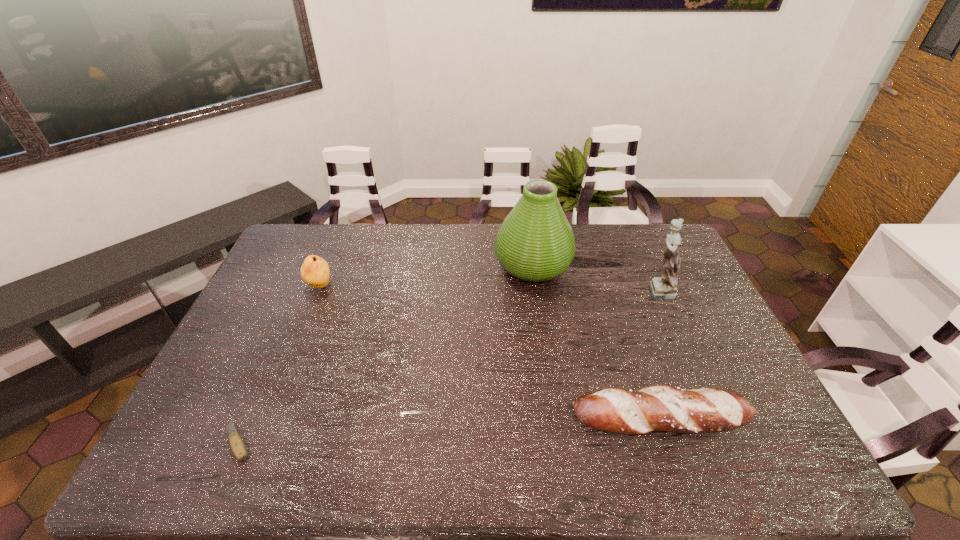
Image resolution: width=960 pixels, height=540 pixels. I want to click on free space between the figurine and the fourth tallest object, so click(659, 355).

Identify the location of free space that is in between the figurine and the pear. (489, 288).

The width and height of the screenshot is (960, 540). Find the location of `free space between the pear and the vase`. free space between the pear and the vase is located at coordinates (426, 275).

The width and height of the screenshot is (960, 540). In order to click on free spot between the vase and the pear in this screenshot , I will do `click(426, 275)`.

Find the location of a particular element. This screenshot has height=540, width=960. unoccupied position between the pear and the figurine is located at coordinates (489, 288).

Choose which object is the third nearest neighbor to the shortest object. Please provide its 2D coordinates. Your answer should be formatted as a tuple, i.e. [(x, y)], where the tuple contains the x and y coordinates of a point satisfying the conditions above.

[(665, 408)]

Locate which object is the second closest to the baguet. Please provide its 2D coordinates. Your answer should be formatted as a tuple, i.e. [(x, y)], where the tuple contains the x and y coordinates of a point satisfying the conditions above.

[(535, 242)]

I want to click on vacant space that satisfies the following two spatial constraints: 1. on the back side of the shortest object; 2. on the right side of the vase, so click(317, 264).

At what (x,y) coordinates should I click in order to perform the action: click on free point that satisfies the following two spatial constraints: 1. on the front side of the third tallest object; 2. on the left side of the second shortest object. Please return your answer as a coordinate pair (x, y). Looking at the image, I should click on (265, 420).